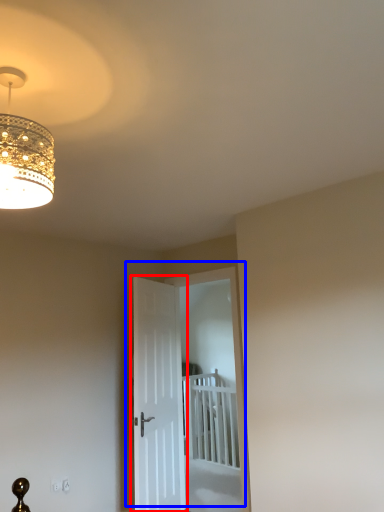
Question: Which object appears closest to the camera in this image, door (highlighted by a red box) or door (highlighted by a blue box)?

Choices:
 (A) door
 (B) door

Answer: (A)